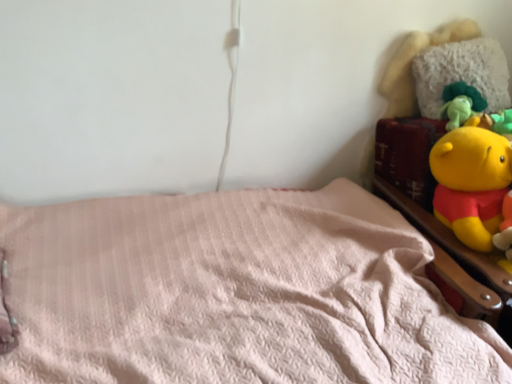
Question: Considering the relative sizes of wooden bed frame at upper right and pink fluffy blanket at lower left in the image provided, is wooden bed frame at upper right wider than pink fluffy blanket at lower left?

Choices:
 (A) no
 (B) yes

Answer: (A)

Question: Is wooden bed frame at upper right closer to camera compared to pink fluffy blanket at lower left?

Choices:
 (A) yes
 (B) no

Answer: (B)

Question: Does wooden bed frame at upper right have a lesser height compared to pink fluffy blanket at lower left?

Choices:
 (A) no
 (B) yes

Answer: (B)

Question: Is wooden bed frame at upper right not within pink fluffy blanket at lower left?

Choices:
 (A) no
 (B) yes

Answer: (B)

Question: From a real-world perspective, is wooden bed frame at upper right positioned under pink fluffy blanket at lower left based on gravity?

Choices:
 (A) yes
 (B) no

Answer: (B)

Question: Can you confirm if wooden bed frame at upper right is thinner than pink fluffy blanket at lower left?

Choices:
 (A) yes
 (B) no

Answer: (A)

Question: Is pink fluffy blanket at lower left bigger than wooden bed frame at upper right?

Choices:
 (A) no
 (B) yes

Answer: (B)

Question: Considering the relative positions of pink fluffy blanket at lower left and wooden bed frame at upper right in the image provided, is pink fluffy blanket at lower left to the left of wooden bed frame at upper right from the viewer's perspective?

Choices:
 (A) yes
 (B) no

Answer: (A)

Question: Does pink fluffy blanket at lower left come in front of wooden bed frame at upper right?

Choices:
 (A) no
 (B) yes

Answer: (B)

Question: Does pink fluffy blanket at lower left have a smaller size compared to wooden bed frame at upper right?

Choices:
 (A) no
 (B) yes

Answer: (A)

Question: From the image's perspective, is pink fluffy blanket at lower left over wooden bed frame at upper right?

Choices:
 (A) no
 (B) yes

Answer: (A)

Question: Is pink fluffy blanket at lower left looking in the opposite direction of wooden bed frame at upper right?

Choices:
 (A) yes
 (B) no

Answer: (B)

Question: Can wooden bed frame at upper right be found inside fluffy white pillow at upper right?

Choices:
 (A) no
 (B) yes

Answer: (A)